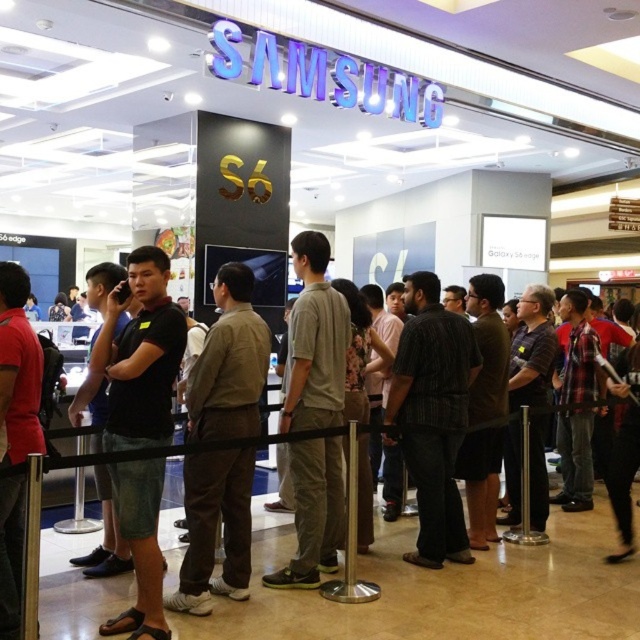
You are trying to decide between two shirts in a store. You see a brown cotton shirt at center and a black cotton shirt at center. Which shirt has a thinner material?

The brown cotton shirt at center is thinner than the black cotton shirt at center.

You are trying to decide between two shirts in a Samsung store. You see a black cotton shirt at center and a matte black shirt at left. Which shirt is taller?

The black cotton shirt at center is much taller than the matte black shirt at left.

You are a customer in the Samsung store and want to compare two shirts displayed near the entrance. The black cotton shirt at center and the matte black shirt at left are both on display. Which shirt is located lower in position?

The black cotton shirt at center is positioned under the matte black shirt at left, so it is located lower in position.